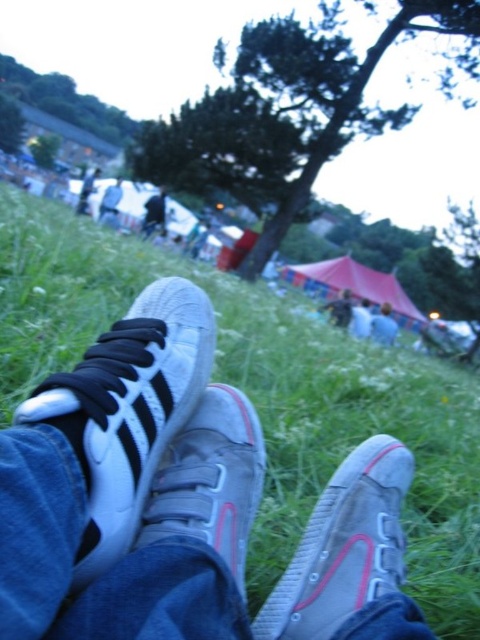
Which is more to the right, white leather sneaker at center or denim jacket at lower right?

Positioned to the right is denim jacket at lower right.

Is white leather sneaker at center wider than denim jacket at lower right?

No, white leather sneaker at center is not wider than denim jacket at lower right.

Is point (203, 292) farther from camera compared to point (360, 308)?

No, (203, 292) is in front of (360, 308).

At what (x,y) coordinates should I click in order to perform the action: click on white leather sneaker at center. Please return your answer as a coordinate pair (x, y). The image size is (480, 640). Looking at the image, I should click on (128, 410).

Between white leather sneaker at center and white canvas shoe at lower center, which one has more height?

white canvas shoe at lower center

Between white leather sneaker at center and white canvas shoe at lower center, which one is positioned lower?

white leather sneaker at center is lower down.

At what (x,y) coordinates should I click in order to perform the action: click on white leather sneaker at center. Please return your answer as a coordinate pair (x, y). The height and width of the screenshot is (640, 480). Looking at the image, I should click on (128, 410).

Describe the element at coordinates (154, 212) in the screenshot. This screenshot has width=480, height=640. I see `black leather jacket at upper center` at that location.

Between point (147, 236) and point (361, 317), which one is positioned in front?

Point (361, 317)

Identify the location of black leather jacket at upper center. This screenshot has height=640, width=480. (154, 212).

This screenshot has height=640, width=480. Identify the location of black leather jacket at upper center. (154, 212).